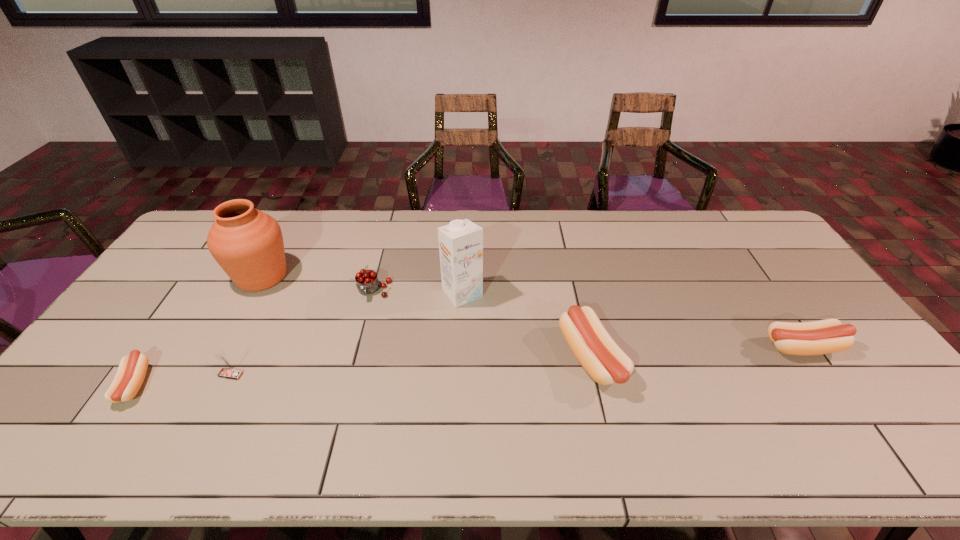
Locate an element on the screen. vacant area at the near edge is located at coordinates (534, 387).

Image resolution: width=960 pixels, height=540 pixels. I want to click on free space at the right edge, so click(841, 361).

In the image, there is a desktop. At what (x,y) coordinates should I click in order to perform the action: click on free region at the near left corner. Please return your answer as a coordinate pair (x, y). Image resolution: width=960 pixels, height=540 pixels. Looking at the image, I should click on (62, 412).

This screenshot has width=960, height=540. I want to click on empty space that is in between the leftmost object and the urn, so click(x=199, y=330).

Locate an element on the screen. This screenshot has width=960, height=540. free space between the leftmost sausage and the matchbox is located at coordinates (183, 379).

The height and width of the screenshot is (540, 960). In order to click on unoccupied area between the carton and the rightmost object in this screenshot , I will do `click(633, 320)`.

Locate an element on the screen. This screenshot has height=540, width=960. empty space between the second tallest sausage and the shortest sausage is located at coordinates (468, 366).

Identify the location of vacant space that's between the matchbox and the second sausage from right to left. The height and width of the screenshot is (540, 960). (412, 366).

Where is `unoccupied position between the carton and the matchbox`? unoccupied position between the carton and the matchbox is located at coordinates (347, 334).

This screenshot has width=960, height=540. I want to click on free point between the matchbox and the carton, so click(347, 334).